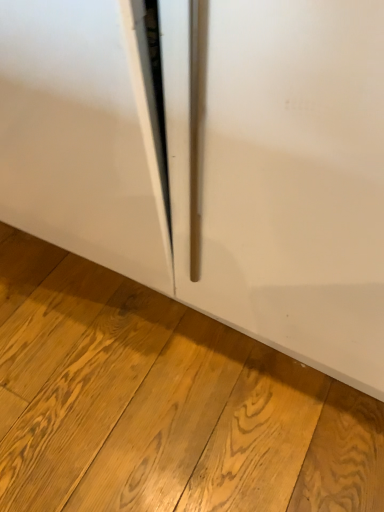
What do you see at coordinates (83, 135) in the screenshot? This screenshot has height=512, width=384. I see `white glossy door at center` at bounding box center [83, 135].

In order to click on white glossy door at center in this screenshot , I will do `click(83, 135)`.

This screenshot has width=384, height=512. Identify the location of white glossy door at center. (83, 135).